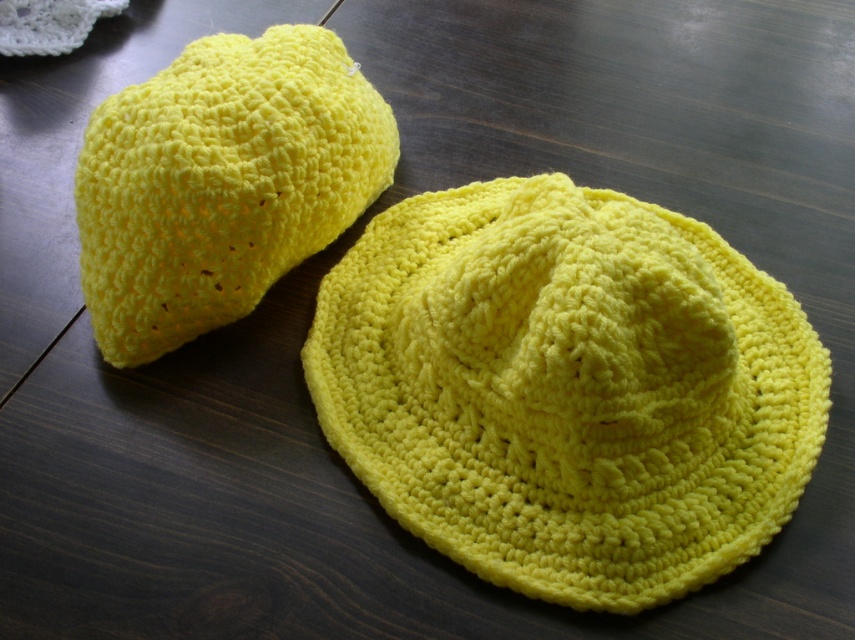
You are a GUI agent. You are given a task and a screenshot of the screen. Output one action in this format:
    pyautogui.click(x=<x>, y=<y>)
    Task: Click on the yellow crochet hat at center
    Image resolution: width=855 pixels, height=640 pixels.
    Given the screenshot: What is the action you would take?
    click(567, 388)

Looking at this image, who is positioned more to the right, yellow crochet hat at center or yellow crochet hat at upper left?

From the viewer's perspective, yellow crochet hat at center appears more on the right side.

Does point (706, 369) come farther from viewer compared to point (278, 140)?

That is False.

Identify the location of yellow crochet hat at center. This screenshot has height=640, width=855. (567, 388).